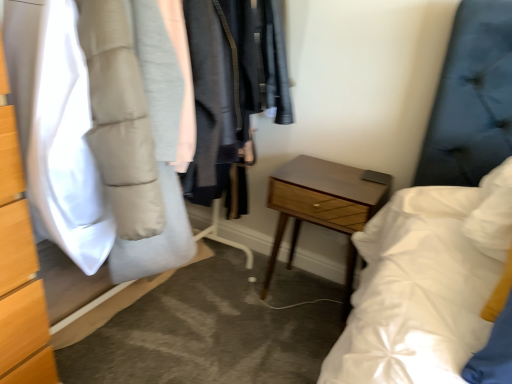
Question: Considering their positions, is matte gray puffer jacket at left located in front of or behind white matte puffer jacket at left?

Choices:
 (A) front
 (B) behind

Answer: (A)

Question: Is matte gray puffer jacket at left taller or shorter than white matte puffer jacket at left?

Choices:
 (A) tall
 (B) short

Answer: (A)

Question: Based on their relative distances, which object is farther from the matte gray puffer jacket at left?

Choices:
 (A) white matte puffer jacket at left
 (B) woodenmaterial/texturenightstand at center

Answer: (B)

Question: Considering the real-world distances, which object is closest to the white matte puffer jacket at left?

Choices:
 (A) woodenmaterial/texturenightstand at center
 (B) matte gray puffer jacket at left

Answer: (B)